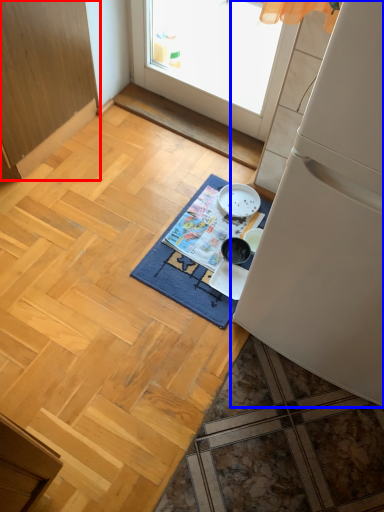
Question: Which object appears farthest to the camera in this image, cabinetry (highlighted by a red box) or refrigerator (highlighted by a blue box)?

Choices:
 (A) cabinetry
 (B) refrigerator

Answer: (A)